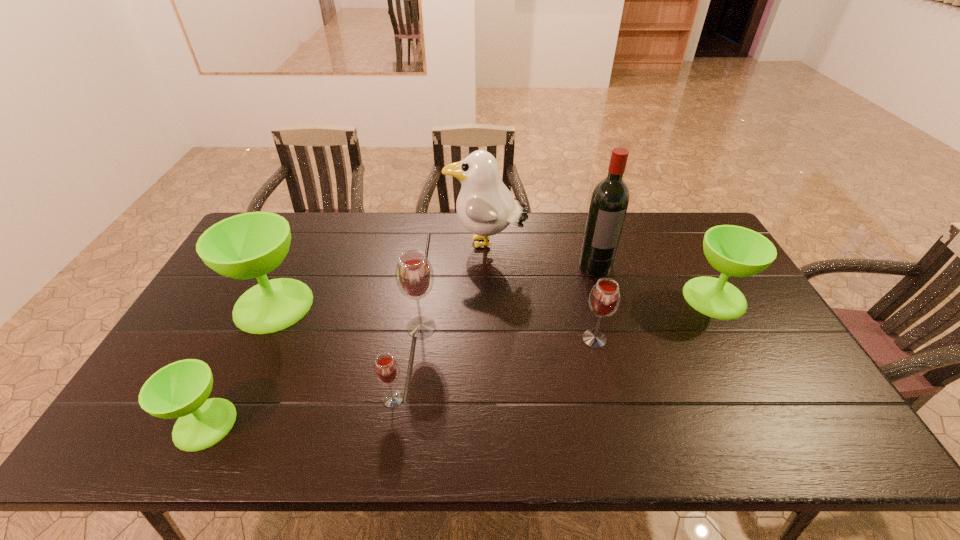
This screenshot has width=960, height=540. Identify the location of vacant position in the image that satisfies the following two spatial constraints: 1. on the back side of the biggest red wineglass; 2. on the left side of the smallest green wineglass. (253, 327).

The height and width of the screenshot is (540, 960). Find the location of `vacant space that satisfies the following two spatial constraints: 1. on the label of the wine bottle; 2. on the left side of the rightmost wineglass`. vacant space that satisfies the following two spatial constraints: 1. on the label of the wine bottle; 2. on the left side of the rightmost wineglass is located at coordinates (605, 298).